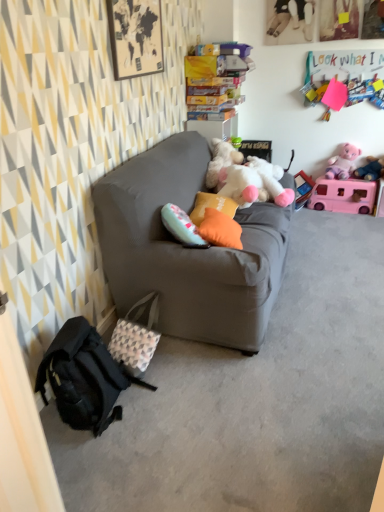
Image resolution: width=384 pixels, height=512 pixels. I want to click on vacant area that lies to the right of black fabric backpack at lower left, so click(181, 404).